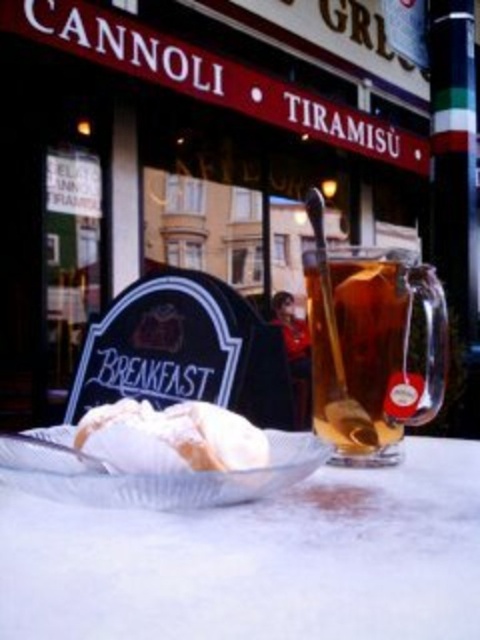
Between point (100, 580) and point (72, 500), which one is positioned behind?

Positioned behind is point (72, 500).

Is white glossy table at center taller than clear glass plate at center?

No, white glossy table at center is not taller than clear glass plate at center.

You are a GUI agent. You are given a task and a screenshot of the screen. Output one action in this format:
    pyautogui.click(x=<x>, y=<y>)
    Task: Click on the white glossy table at center
    
    Given the screenshot: What is the action you would take?
    pyautogui.click(x=257, y=561)

Where is `white glossy table at center`? Image resolution: width=480 pixels, height=640 pixels. white glossy table at center is located at coordinates (257, 561).

Does white glossy table at center lie in front of white powdered sugar at center?

Yes, white glossy table at center is closer to the viewer.

Does white glossy table at center have a greater height compared to white powdered sugar at center?

In fact, white glossy table at center may be shorter than white powdered sugar at center.

Does point (411, 529) lie behind point (86, 449)?

No.

Identify the location of white glossy table at center. The image size is (480, 640). tap(257, 561).

How far apart are translucent glass carafe at center and clear glass plate at center?

5.39 inches

Who is shorter, translucent glass carafe at center or clear glass plate at center?

clear glass plate at center is shorter.

Is point (408, 316) positioned after point (68, 470)?

Yes, point (408, 316) is behind point (68, 470).

Locate an element on the screen. Image resolution: width=480 pixels, height=640 pixels. translucent glass carafe at center is located at coordinates coord(372,349).